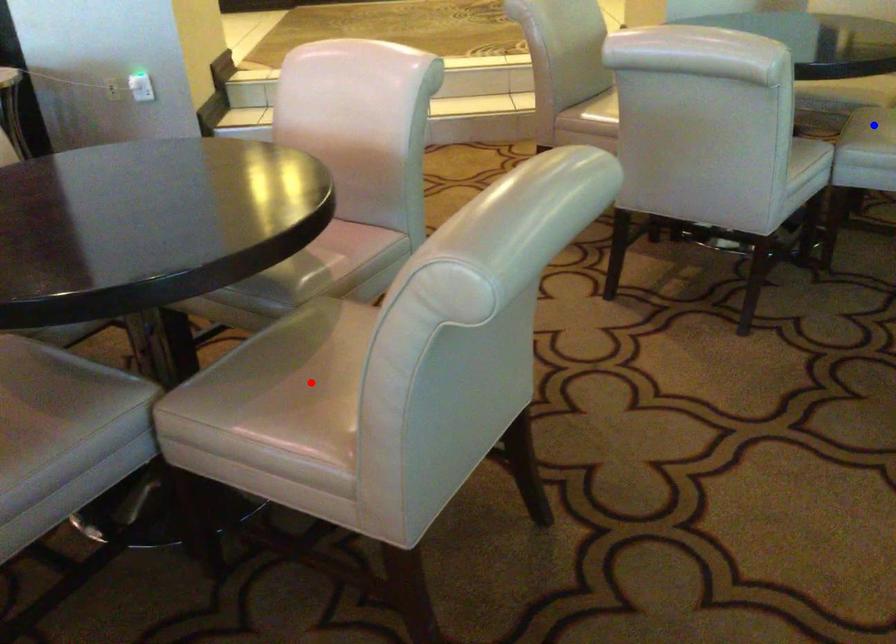
Question: Which of the two points in the image is closer to the camera?

Choices:
 (A) Blue point is closer.
 (B) Red point is closer.

Answer: (B)